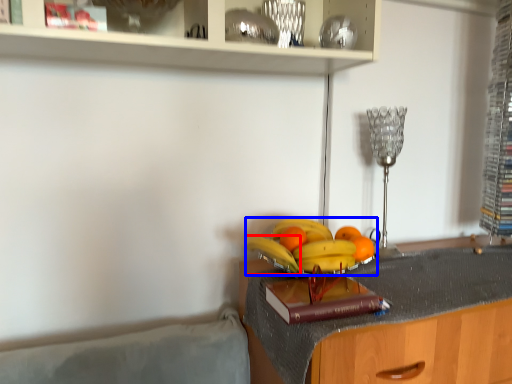
Question: Which object is closer to the camera taking this photo, banana (highlighted by a red box) or banana (highlighted by a blue box)?

Choices:
 (A) banana
 (B) banana

Answer: (B)